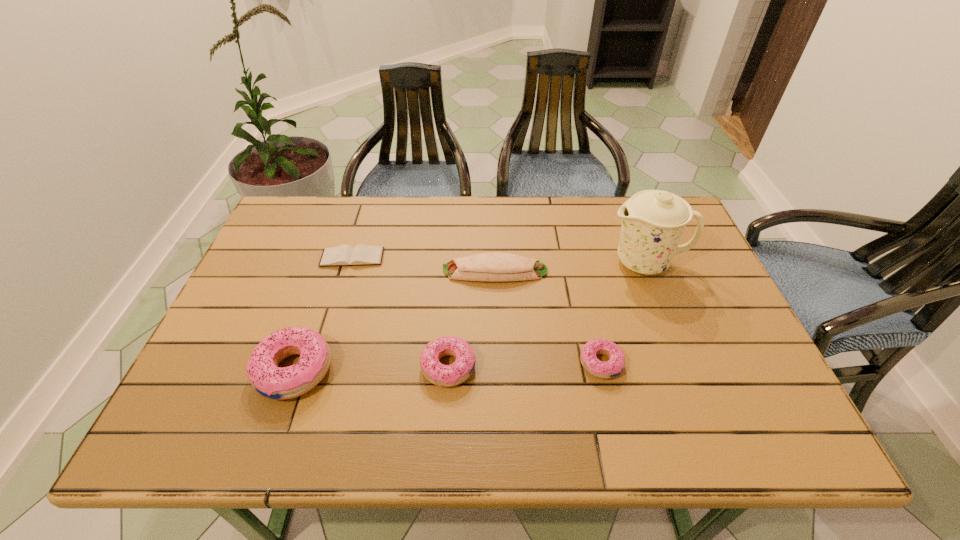
Where is `doughnut that is the closest to the leftmost doughnut`? doughnut that is the closest to the leftmost doughnut is located at coordinates (435, 372).

The height and width of the screenshot is (540, 960). I want to click on vacant area that satisfies the following two spatial constraints: 1. at the bitten end of the burrito; 2. on the front side of the fifth shortest object, so [x=498, y=370].

You are a GUI agent. You are given a task and a screenshot of the screen. Output one action in this format:
    pyautogui.click(x=<x>, y=<y>)
    Task: Click on the vacant space that satisfies the following two spatial constraints: 1. at the bitten end of the burrito; 2. on the right side of the shortest doughnut
    The width and height of the screenshot is (960, 540).
    Given the screenshot: What is the action you would take?
    pyautogui.click(x=498, y=363)

Where is `vacant point that satisfies the following two spatial constraints: 1. on the back side of the fifth shortest object; 2. on the left side of the second shortest doughnut`? vacant point that satisfies the following two spatial constraints: 1. on the back side of the fifth shortest object; 2. on the left side of the second shortest doughnut is located at coordinates (296, 367).

This screenshot has height=540, width=960. In order to click on free location that satisfies the following two spatial constraints: 1. at the bitten end of the burrito; 2. on the left side of the rightmost doughnut in this screenshot , I will do `click(498, 363)`.